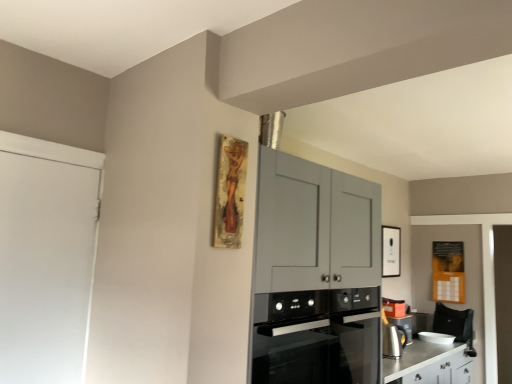
Describe the element at coordinates (424, 363) in the screenshot. I see `silver metallic counter at lower right` at that location.

What do you see at coordinates (317, 337) in the screenshot? The width and height of the screenshot is (512, 384). I see `black glass oven at center` at bounding box center [317, 337].

Measure the distance between black glass oven at center and camera.

black glass oven at center and camera are 5.71 feet apart.

What do you see at coordinates (393, 340) in the screenshot? I see `satin silver kettle at lower right, which is the second appliance from right to left` at bounding box center [393, 340].

In order to face white matte door at left, should I rotate leftwards or rightwards?

A 26.806 degree turn to the left will do.

The width and height of the screenshot is (512, 384). What are the coordinates of `white glossy bowl at lower right, the 2th appliance positioned from the top` in the screenshot? It's located at (436, 338).

Where is `silver metallic counter at lower right`? silver metallic counter at lower right is located at coordinates (424, 363).

Is black glass oven at center facing towards satin silver kettle at lower right, which is the second appliance from bottom to top?

No, black glass oven at center is not aimed at satin silver kettle at lower right, which is the second appliance from bottom to top.

Is there a large distance between black glass oven at center and satin silver kettle at lower right, which is counted as the 1th appliance, starting from the top?

black glass oven at center is near satin silver kettle at lower right, which is counted as the 1th appliance, starting from the top, not far away.

From a real-world perspective, is black glass oven at center under satin silver kettle at lower right, which is the second appliance from right to left?

No.

Considering the sizes of objects black glass oven at center and satin silver kettle at lower right, marked as the second appliance in a back-to-front arrangement, in the image provided, who is wider, black glass oven at center or satin silver kettle at lower right, marked as the second appliance in a back-to-front arrangement,?

black glass oven at center is wider.

Is white matte door at left behind white glossy bowl at lower right, acting as the 1th appliance starting from the right?

No.

Between white matte door at left and white glossy bowl at lower right, the 1th appliance when ordered from bottom to top, which one has less height?

white glossy bowl at lower right, the 1th appliance when ordered from bottom to top.

What's the angular difference between white matte door at left and white glossy bowl at lower right, acting as the 1th appliance starting from the right,'s facing directions?

There is a 1.56-degree angle between the facing directions of white matte door at left and white glossy bowl at lower right, acting as the 1th appliance starting from the right.

Which point is more distant from viewer, (x=4, y=176) or (x=419, y=337)?

Positioned behind is point (x=419, y=337).

From the image's perspective, which object appears higher, white matte door at left or black glass oven at center?

white matte door at left.

Is white matte door at left looking in the opposite direction of black glass oven at center?

white matte door at left does not have its back to black glass oven at center.

Could black glass oven at center be considered to be inside white matte door at left?

Actually, black glass oven at center is outside white matte door at left.

Considering the sizes of objects white matte door at left and black glass oven at center in the image provided, who is taller, white matte door at left or black glass oven at center?

white matte door at left.

Between satin silver kettle at lower right, which is counted as the 1th appliance, starting from the top, and white glossy bowl at lower right, marked as the second appliance in a front-to-back arrangement, which one has smaller size?

Smaller between the two is white glossy bowl at lower right, marked as the second appliance in a front-to-back arrangement.

Is satin silver kettle at lower right, the 1th appliance in the front-to-back sequence, beside white glossy bowl at lower right, the 1th appliance when ordered from bottom to top?

No, satin silver kettle at lower right, the 1th appliance in the front-to-back sequence, is not touching white glossy bowl at lower right, the 1th appliance when ordered from bottom to top.

Could you tell me if satin silver kettle at lower right, which is the second appliance from right to left, is turned towards white glossy bowl at lower right, the 1th appliance when ordered from bottom to top?

No, satin silver kettle at lower right, which is the second appliance from right to left, is not aimed at white glossy bowl at lower right, the 1th appliance when ordered from bottom to top.

Locate an element on the screen. The width and height of the screenshot is (512, 384). appliance that is above the white glossy bowl at lower right, acting as the 1th appliance starting from the right (from a real-world perspective) is located at coordinates (393, 340).

Which is more to the left, silver metallic counter at lower right or white glossy picture frame at upper right?

Positioned to the left is silver metallic counter at lower right.

Looking at this image, which of these two, silver metallic counter at lower right or white glossy picture frame at upper right, is bigger?

With larger size is silver metallic counter at lower right.

From a real-world perspective, does silver metallic counter at lower right sit lower than white glossy picture frame at upper right?

Correct, in the physical world, silver metallic counter at lower right is lower than white glossy picture frame at upper right.

How distant is silver metallic counter at lower right from white glossy picture frame at upper right?

A distance of 37.10 inches exists between silver metallic counter at lower right and white glossy picture frame at upper right.

Does white glossy picture frame at upper right have a smaller size compared to black glass oven at center?

Yes, white glossy picture frame at upper right is smaller than black glass oven at center.

From the image's perspective, is white glossy picture frame at upper right beneath black glass oven at center?

No.

Is white glossy picture frame at upper right placed right next to black glass oven at center?

There is a gap between white glossy picture frame at upper right and black glass oven at center.

From the image's perspective, count 2nd appliances upward from the silver metallic counter at lower right and point to it. Please provide its 2D coordinates.

[(393, 340)]

Who is taller, silver metallic counter at lower right or satin silver kettle at lower right, which is the second appliance from bottom to top?

silver metallic counter at lower right.

Is silver metallic counter at lower right thinner than satin silver kettle at lower right, the 1th appliance in the front-to-back sequence?

No, silver metallic counter at lower right is not thinner than satin silver kettle at lower right, the 1th appliance in the front-to-back sequence.

How different are the orientations of silver metallic counter at lower right and satin silver kettle at lower right, which is the second appliance from bottom to top, in degrees?

45.5 degrees separate the facing orientations of silver metallic counter at lower right and satin silver kettle at lower right, which is the second appliance from bottom to top.

Locate an element on the screen. kitchen appliance on the left side of satin silver kettle at lower right, the 1th appliance in the front-to-back sequence is located at coordinates (317, 337).

Find the location of a particular element. The height and width of the screenshot is (384, 512). appliance that is the 2nd one when counting downward from the white matte door at left (from the image's perspective) is located at coordinates click(436, 338).

Looking at the image, which one is located further to satin silver kettle at lower right, the 1th appliance in the front-to-back sequence, silver metallic counter at lower right or white glossy picture frame at upper right?

white glossy picture frame at upper right.

When comparing their distances from silver metallic counter at lower right, does white glossy bowl at lower right, which ranks as the second appliance in left-to-right order, or satin silver kettle at lower right, which is the second appliance from bottom to top, seem further?

The object further to silver metallic counter at lower right is white glossy bowl at lower right, which ranks as the second appliance in left-to-right order.

Considering their positions, is white matte door at left positioned closer to satin silver kettle at lower right, which is the second appliance from right to left, than black glass oven at center?

Based on the image, black glass oven at center appears to be nearer to satin silver kettle at lower right, which is the second appliance from right to left.

Estimate the real-world distances between objects in this image. Which object is further from white glossy picture frame at upper right, satin silver kettle at lower right, which is counted as the 1th appliance, starting from the top, or white matte door at left?

Among the two, white matte door at left is located further to white glossy picture frame at upper right.

From the image, which object appears to be farther from silver metallic counter at lower right, white matte door at left or satin silver kettle at lower right, the 1th appliance in the front-to-back sequence?

white matte door at left is further to silver metallic counter at lower right.

In the scene shown: Estimate the real-world distances between objects in this image. Which object is further from white glossy bowl at lower right, which ranks as the 1th appliance in back-to-front order, black glass oven at center or white matte door at left?

Based on the image, white matte door at left appears to be further to white glossy bowl at lower right, which ranks as the 1th appliance in back-to-front order.

Based on the photo, estimate the real-world distances between objects in this image. Which object is further from white glossy picture frame at upper right, white glossy bowl at lower right, the 2th appliance positioned from the top, or silver metallic counter at lower right?

silver metallic counter at lower right is further to white glossy picture frame at upper right.

Based on their spatial positions, is white glossy bowl at lower right, acting as the 1th appliance starting from the right, or satin silver kettle at lower right, marked as the first appliance in a left-to-right arrangement, closer to white matte door at left?

The object closer to white matte door at left is satin silver kettle at lower right, marked as the first appliance in a left-to-right arrangement.

This screenshot has height=384, width=512. What are the coordinates of `kitchen appliance situated between white matte door at left and white glossy bowl at lower right, the 1th appliance when ordered from bottom to top, from left to right` in the screenshot? It's located at (317, 337).

The width and height of the screenshot is (512, 384). I want to click on counter between black glass oven at center and white glossy bowl at lower right, which ranks as the 1th appliance in back-to-front order, in the front-back direction, so click(x=424, y=363).

The image size is (512, 384). What are the coordinates of `counter between black glass oven at center and satin silver kettle at lower right, which is the second appliance from bottom to top, from front to back` in the screenshot? It's located at (424, 363).

Identify the location of appliance between white matte door at left and white glossy picture frame at upper right from left to right. The image size is (512, 384). (393, 340).